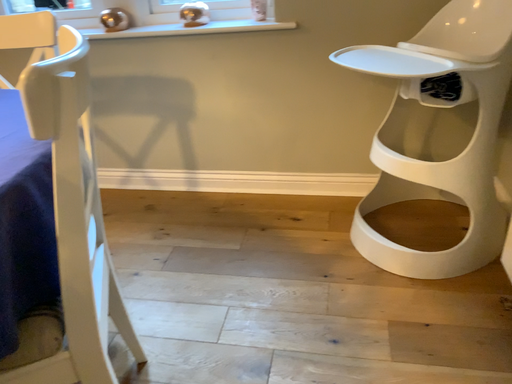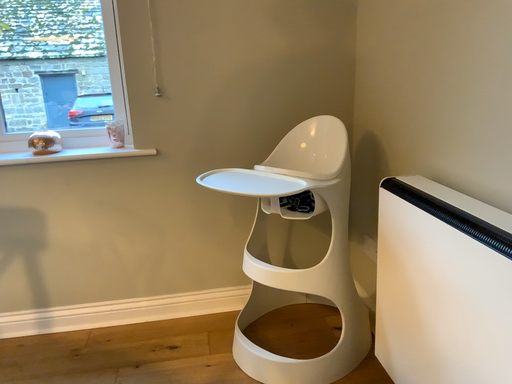
Question: Which way did the camera rotate in the video?

Choices:
 (A) rotated upward
 (B) rotated downward

Answer: (A)